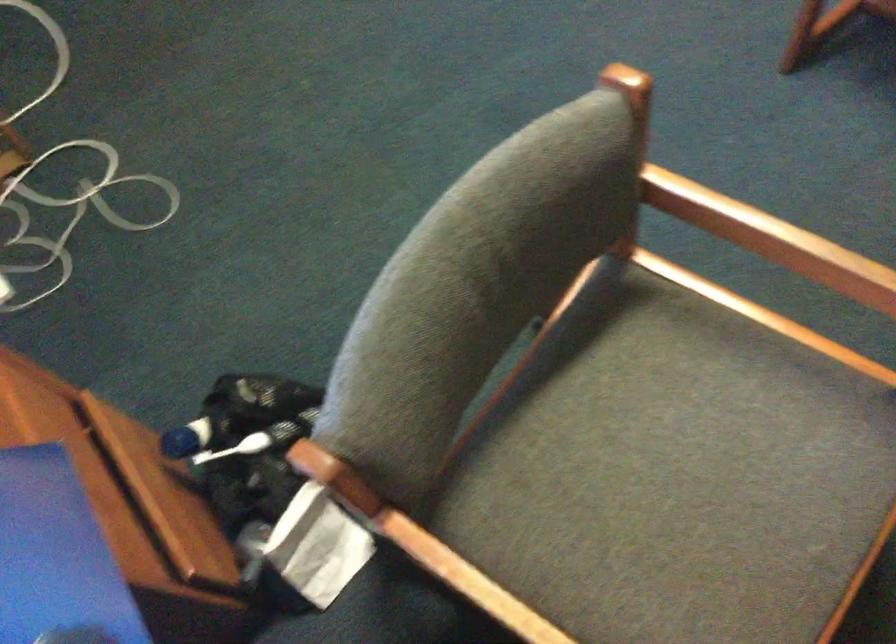
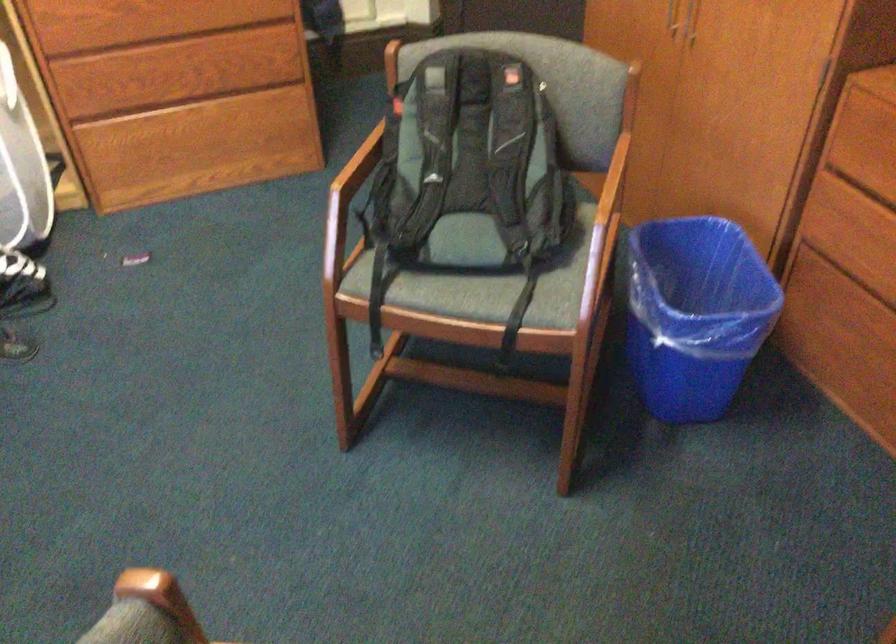
The images are taken continuously from a first-person perspective. In which direction is your viewpoint rotating?

The camera rotated toward right-up.